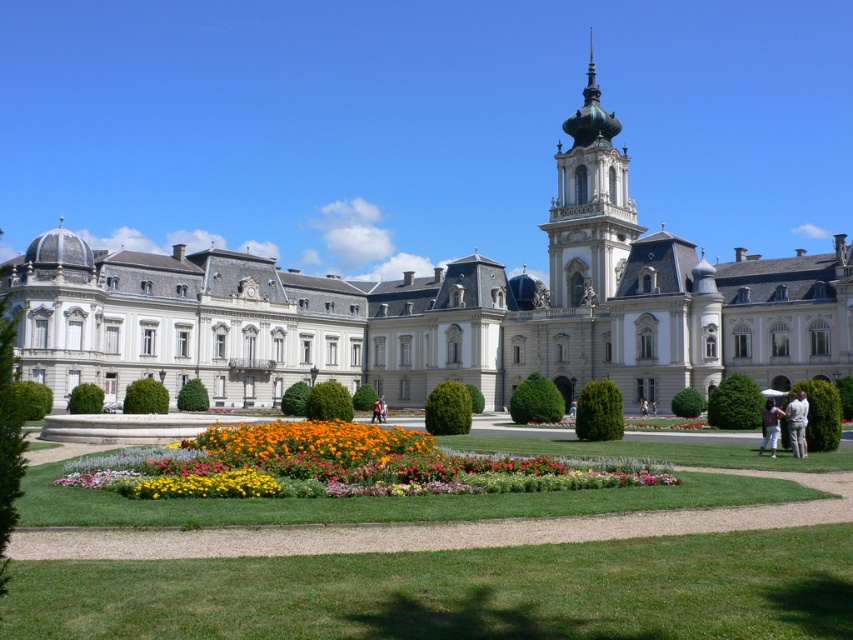
Question: Observing the image, what is the correct spatial positioning of white stone palace at center in reference to white cotton shirt at lower right?

Choices:
 (A) right
 (B) left

Answer: (B)

Question: Can you confirm if green grass at center is positioned to the right of white cotton shirt at lower right?

Choices:
 (A) yes
 (B) no

Answer: (B)

Question: Which point appears closest to the camera in this image?

Choices:
 (A) (419, 513)
 (B) (764, 429)
 (C) (245, 460)

Answer: (A)

Question: Is white fabric shirt at lower right wider than white cotton shirt at lower right?

Choices:
 (A) no
 (B) yes

Answer: (A)

Question: Estimate the real-world distances between objects in this image. Which object is farther from the white stone palace at center?

Choices:
 (A) white cotton shirt at lower right
 (B) white fabric shirt at lower right
 (C) green grass at center
 (D) vibrant multicolored flowers at center

Answer: (B)

Question: Among these points, which one is nearest to the camera?

Choices:
 (A) (792, 451)
 (B) (132, 518)

Answer: (B)